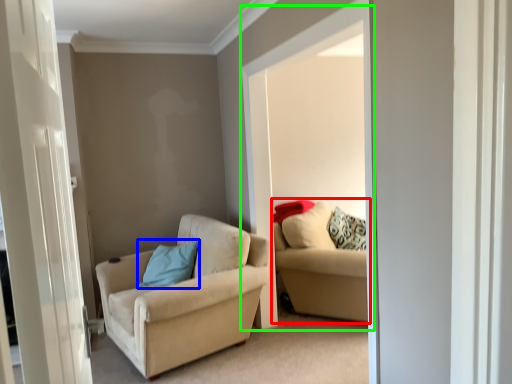
Question: Estimate the real-world distances between objects in this image. Which object is closer to studio couch (highlighted by a red box), pillow (highlighted by a blue box) or window (highlighted by a green box)?

Choices:
 (A) pillow
 (B) window

Answer: (B)